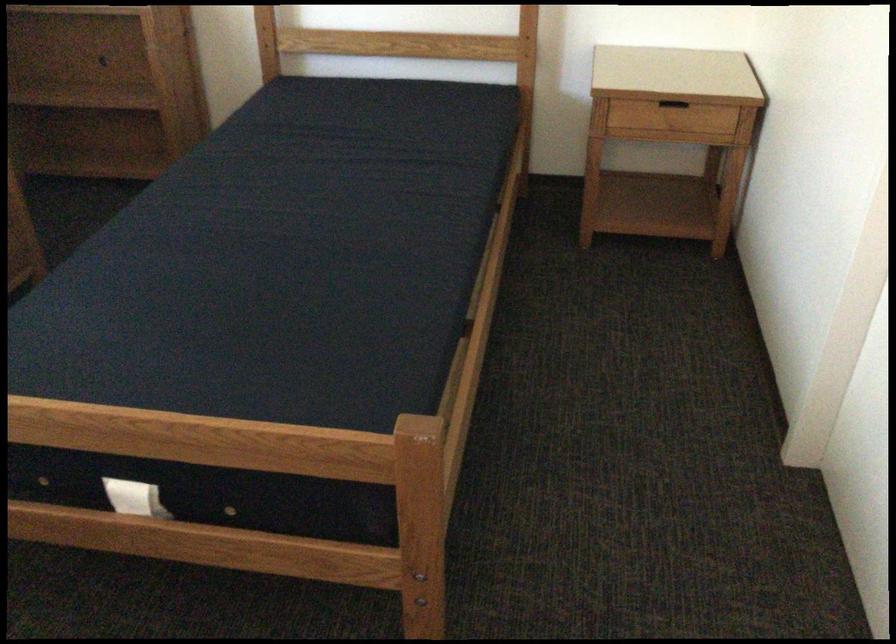
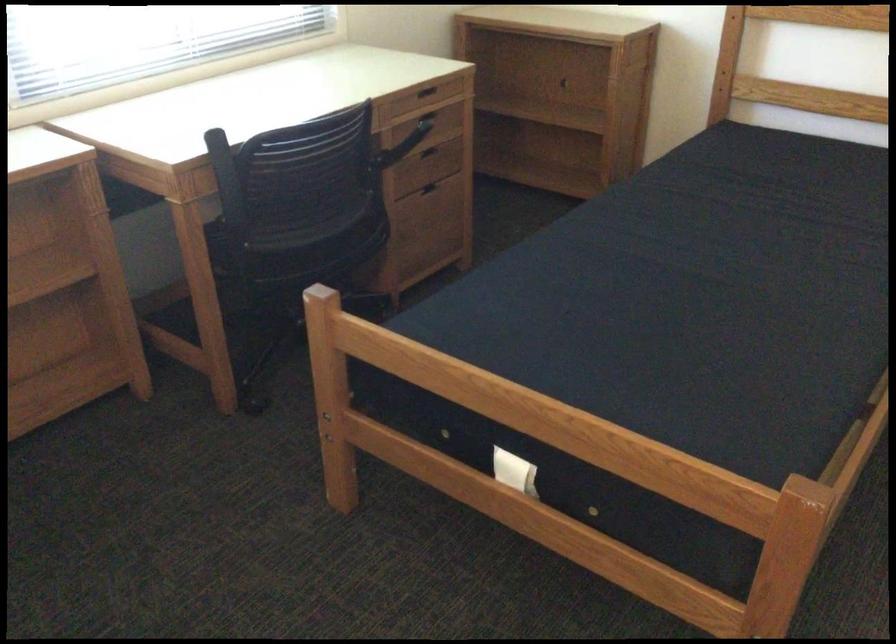
Question: The images are taken continuously from a first-person perspective. In which direction is your viewpoint rotating?

Choices:
 (A) Left
 (B) Right
 (C) Up
 (D) Down

Answer: (A)